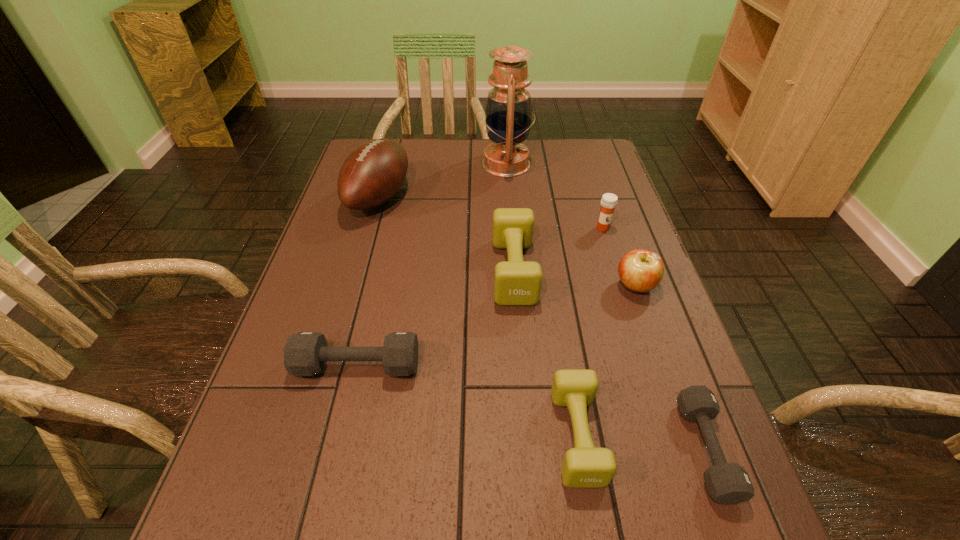
Locate an element on the screen. blue oil lamp is located at coordinates (508, 113).

Image resolution: width=960 pixels, height=540 pixels. In order to click on the tallest object in this screenshot , I will do (x=508, y=113).

Find the location of a particular element. The height and width of the screenshot is (540, 960). football (American) is located at coordinates (373, 173).

Find the location of a particular element. This screenshot has height=540, width=960. brown football (American) is located at coordinates (373, 173).

You are a GUI agent. You are given a task and a screenshot of the screen. Output one action in this format:
    pyautogui.click(x=<x>, y=<y>)
    Task: Click on the bigger olive dumbbell
    Image resolution: width=960 pixels, height=540 pixels.
    Given the screenshot: What is the action you would take?
    pyautogui.click(x=517, y=282)

You are a GUI agent. You are given a task and a screenshot of the screen. Output one action in this format:
    pyautogui.click(x=<x>, y=<y>)
    Task: Click on the left olive dumbbell
    This screenshot has height=540, width=960.
    Given the screenshot: What is the action you would take?
    pyautogui.click(x=517, y=282)

Identify the location of medicine. The height and width of the screenshot is (540, 960). (608, 202).

Locate an element on the screen. This screenshot has width=960, height=540. apple is located at coordinates (640, 270).

At what (x,y) coordinates should I click in order to perform the action: click on the leftmost dumbbell. Please return your answer as a coordinate pair (x, y). This screenshot has width=960, height=540. Looking at the image, I should click on pyautogui.click(x=305, y=353).

Locate an element on the screen. Image resolution: width=960 pixels, height=540 pixels. the farther gray dumbbell is located at coordinates (305, 353).